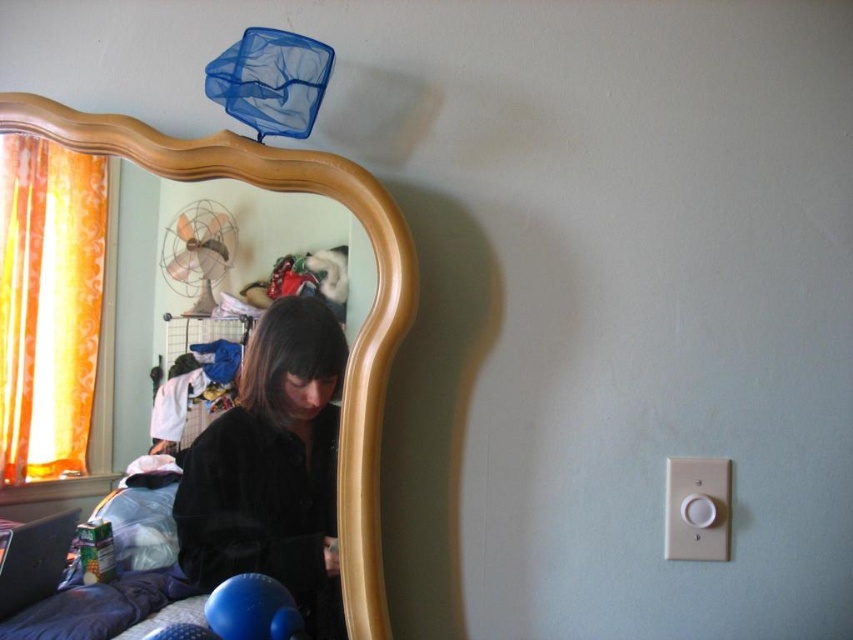
Question: Which object is farther from the camera taking this photo?

Choices:
 (A) wooden mirror at left
 (B) black velvet coat at center
 (C) black plastic laptop at lower left

Answer: (B)

Question: Is black velvet coat at center closer to the viewer compared to wooden mirror at left?

Choices:
 (A) yes
 (B) no

Answer: (B)

Question: Which point appears farthest from the camera in this image?

Choices:
 (A) (134, 134)
 (B) (55, 586)
 (C) (302, 403)

Answer: (A)

Question: Is the position of black velvet coat at center more distant than that of wooden mirror at left?

Choices:
 (A) yes
 (B) no

Answer: (A)

Question: Does black velvet coat at center have a smaller size compared to wooden mirror at left?

Choices:
 (A) no
 (B) yes

Answer: (B)

Question: Which point is farther to the camera?

Choices:
 (A) wooden mirror at left
 (B) black velvet coat at center

Answer: (B)